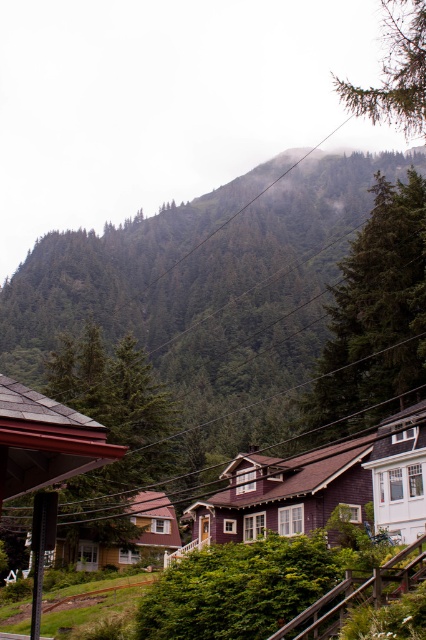
You are a bird looking for a place to perch. You can see the green textured tree at center and the white wood house at right. Which one is taller?

The green textured tree at center is taller than the white wood house at right, so the tree is the taller option for perching.

You are a hiker standing in the residential area looking towards the mountain. You see two green textured trees in your view. Which tree, the green textured tree at center or the green textured tree at upper center, is closer to you?

The green textured tree at center is closer to you because it is bigger than the green textured tree at upper center, which is smaller and farther away.